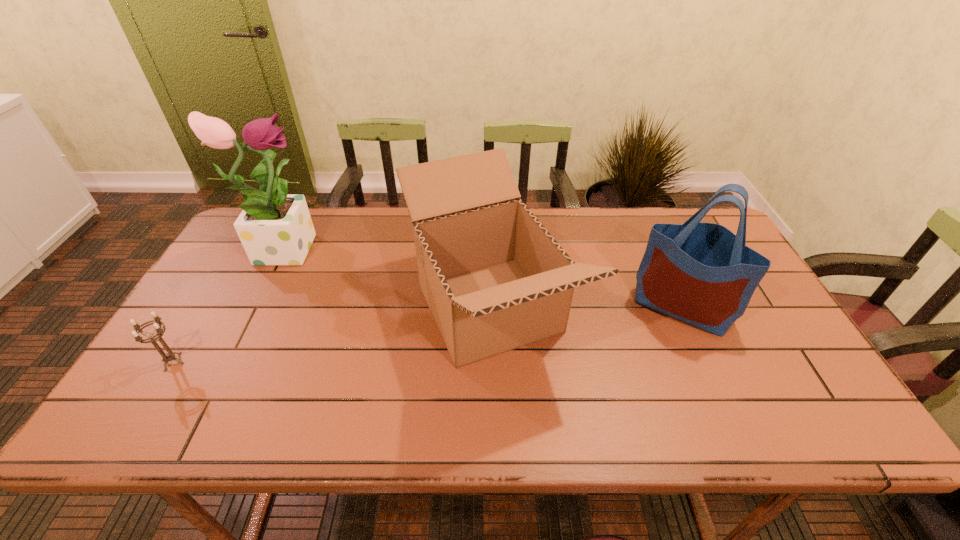
The height and width of the screenshot is (540, 960). What are the coordinates of `the tallest object` in the screenshot? It's located at (274, 228).

Where is `the rightmost object`? Image resolution: width=960 pixels, height=540 pixels. the rightmost object is located at coordinates (703, 274).

Identify the location of the third object from left to right. (494, 278).

Locate an element on the screen. Image resolution: width=960 pixels, height=540 pixels. the shortest object is located at coordinates (169, 356).

The width and height of the screenshot is (960, 540). What are the coordinates of `free spot located 0.350m on the front-facing side of the flower arrangement` in the screenshot? It's located at (433, 246).

You are a GUI agent. You are given a task and a screenshot of the screen. Output one action in this format:
    pyautogui.click(x=<x>, y=<y>)
    Task: Click on the blank space located on the back of the handbag
    
    Given the screenshot: What is the action you would take?
    pyautogui.click(x=653, y=243)

The height and width of the screenshot is (540, 960). In order to click on vacant position located on the right of the box in this screenshot , I will do `click(678, 309)`.

Locate an element on the screen. free space located on the back of the candle holder is located at coordinates 234,263.

Where is `flower arrangement positioned at the far edge`? flower arrangement positioned at the far edge is located at coordinates (274, 228).

I want to click on box located in the far edge section of the desktop, so click(x=494, y=278).